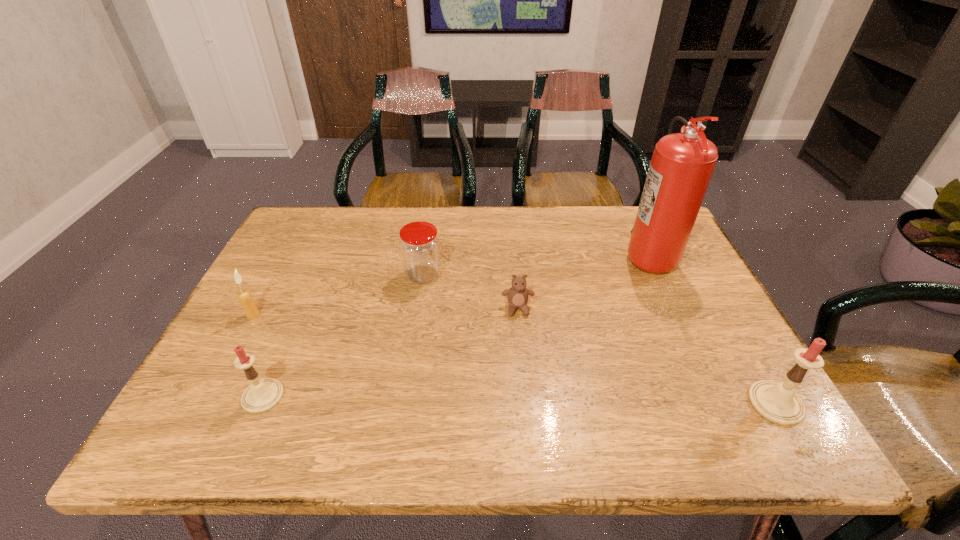
I want to click on object that is at the near left corner, so click(x=262, y=395).

Locate an element on the screen. The width and height of the screenshot is (960, 540). object at the far right corner is located at coordinates (682, 164).

The height and width of the screenshot is (540, 960). Identify the location of object that is at the near right corner. (777, 402).

Find the location of a particular element. blank space at the far edge of the desktop is located at coordinates (571, 221).

What are the coordinates of `blank area at the near edge` in the screenshot? It's located at (535, 393).

Find the location of a particular element. This screenshot has height=540, width=960. free space at the left edge of the desktop is located at coordinates (255, 282).

Identify the location of vacant space that is in between the tallest object and the shortest object. The height and width of the screenshot is (540, 960). (583, 281).

Identify the location of free space between the fire extinguisher and the fifth object from right to left. Image resolution: width=960 pixels, height=540 pixels. (455, 325).

The image size is (960, 540). What are the coordinates of `blank region between the leftmost object and the fire extinguisher` in the screenshot? It's located at (450, 285).

At what (x,y) coordinates should I click in order to perform the action: click on empty space that is in between the second candle from left to right and the farthest candle. Please return your answer as a coordinate pair (x, y). Looking at the image, I should click on (258, 356).